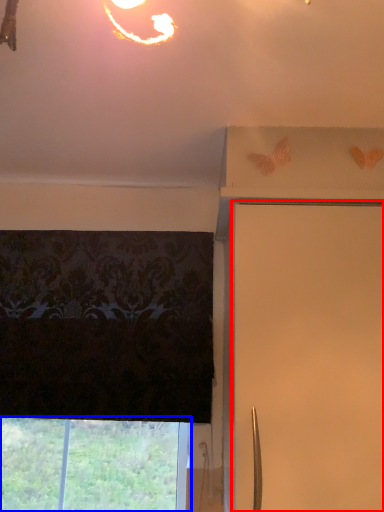
Question: Which point is closer to the camera, shutter (highlighted by a red box) or window (highlighted by a blue box)?

Choices:
 (A) shutter
 (B) window

Answer: (A)